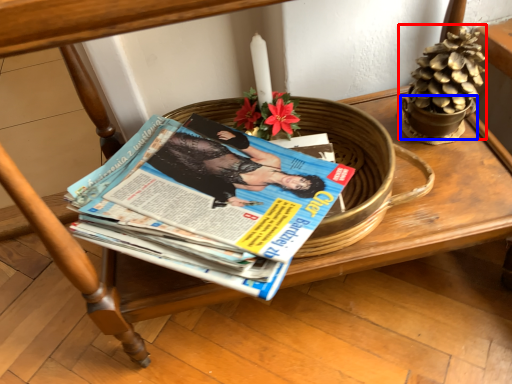
Question: Which object appears closest to the camera in this image, flower basket (highlighted by a red box) or flowerpot (highlighted by a blue box)?

Choices:
 (A) flower basket
 (B) flowerpot

Answer: (A)